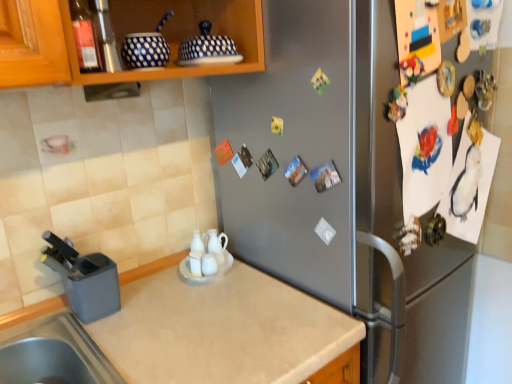
Locate an element on the screen. free space on the front side of gray plastic knife block at lower left, the first appliance in the bottom-to-top sequence is located at coordinates (97, 344).